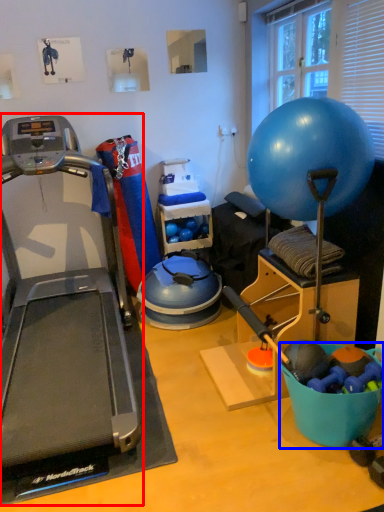
Question: Which object is further to the camera taking this photo, treadmill (highlighted by a red box) or bowl (highlighted by a blue box)?

Choices:
 (A) treadmill
 (B) bowl

Answer: (B)